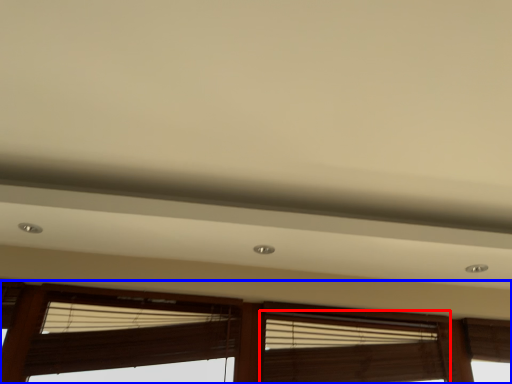
Question: Which object is further to the camera taking this photo, window blind (highlighted by a red box) or window (highlighted by a blue box)?

Choices:
 (A) window blind
 (B) window

Answer: (A)